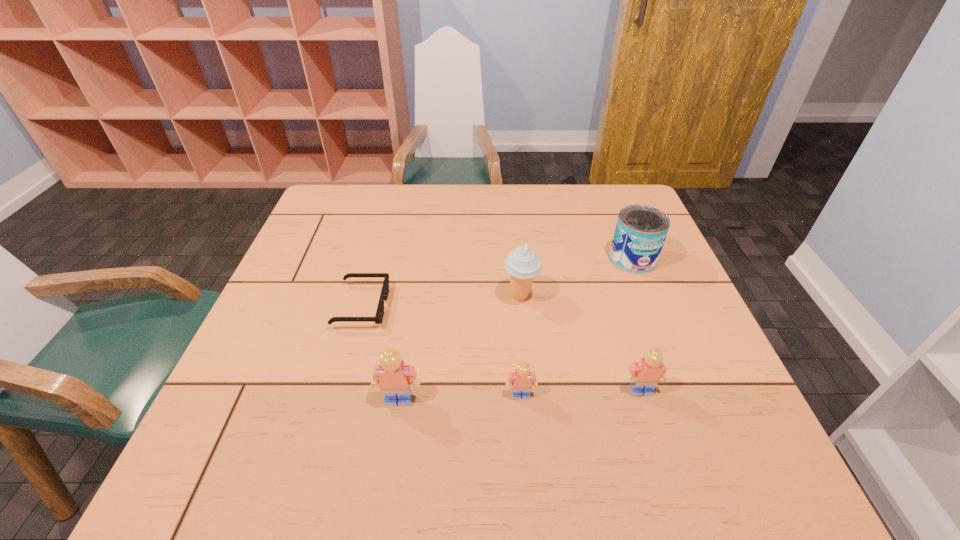
At what (x,y) coordinates should I click in order to perform the action: click on vacant space in between the can and the rightmost Lego. Please return your answer as a coordinate pair (x, y). Looking at the image, I should click on (636, 325).

Locate which object ranks third in proximity to the second Lego from right to left. Please provide its 2D coordinates. Your answer should be formatted as a tuple, i.e. [(x, y)], where the tuple contains the x and y coordinates of a point satisfying the conditions above.

[(522, 264)]

Choose which object is the fifth nearest neighbor to the leftmost object. Please provide its 2D coordinates. Your answer should be formatted as a tuple, i.e. [(x, y)], where the tuple contains the x and y coordinates of a point satisfying the conditions above.

[(640, 232)]

Select which Lego is the second closest to the fifth object from right to left. Please provide its 2D coordinates. Your answer should be formatted as a tuple, i.e. [(x, y)], where the tuple contains the x and y coordinates of a point satisfying the conditions above.

[(646, 374)]

This screenshot has height=540, width=960. I want to click on Lego that is the nearest to the second shortest object, so click(x=393, y=376).